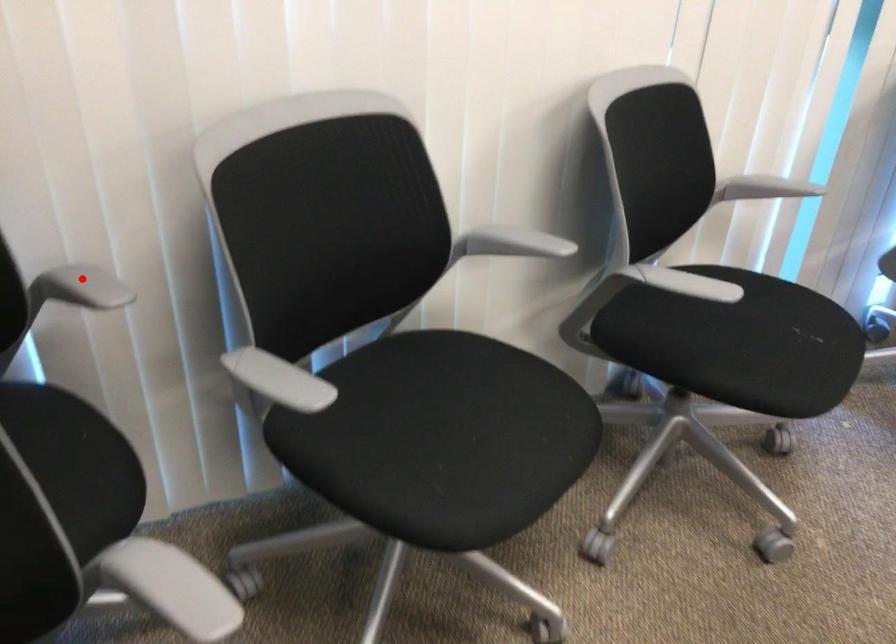
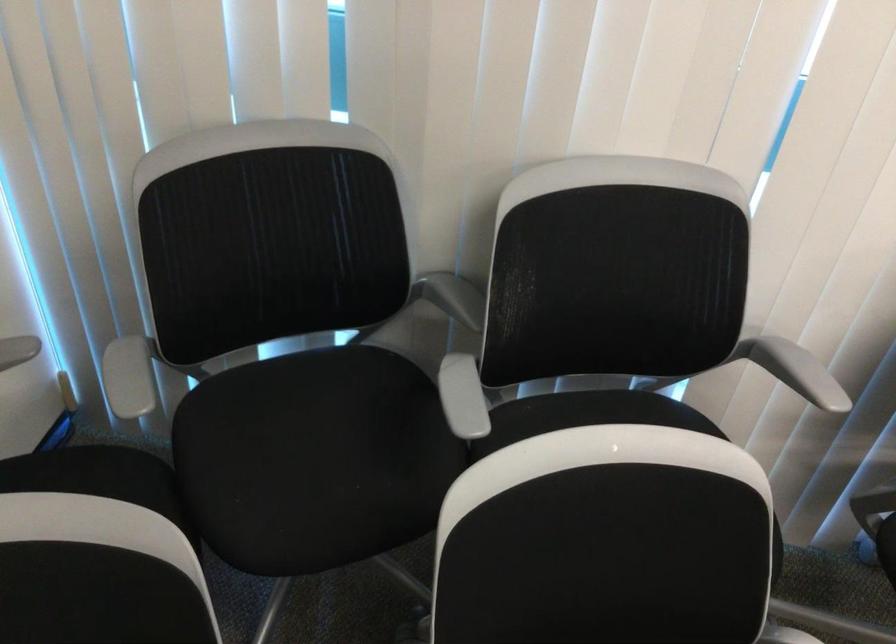
Question: I am providing you with two images of the same scene from different viewpoints. In image1, a red point is highlighted. Considering the same 3D point in image2, which of the following is correct?

Choices:
 (A) It is closer
 (B) It is farther

Answer: (B)